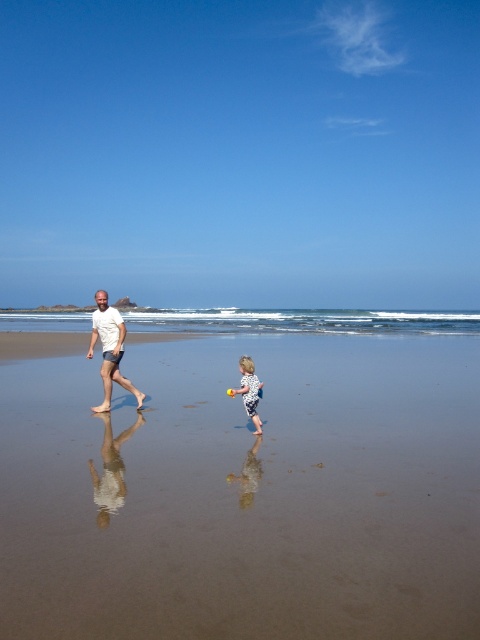
Question: Can you confirm if smooth sand at center is bigger than white cotton t-shirt at center?

Choices:
 (A) no
 (B) yes

Answer: (B)

Question: Which of the following is the farthest from the observer?

Choices:
 (A) (115, 312)
 (B) (357, 310)
 (C) (287, 515)
 (D) (251, 385)

Answer: (B)

Question: Does clear blue water at center have a larger size compared to white cotton t-shirt at center?

Choices:
 (A) no
 (B) yes

Answer: (B)

Question: Is smooth sand at center to the left of white cotton t-shirt at center from the viewer's perspective?

Choices:
 (A) yes
 (B) no

Answer: (B)

Question: Which point is closer to the camera?

Choices:
 (A) (252, 368)
 (B) (264, 353)

Answer: (A)

Question: Among these objects, which one is nearest to the camera?

Choices:
 (A) white cotton t-shirt at center
 (B) white dotted swimsuit at lower center
 (C) clear blue water at center

Answer: (B)